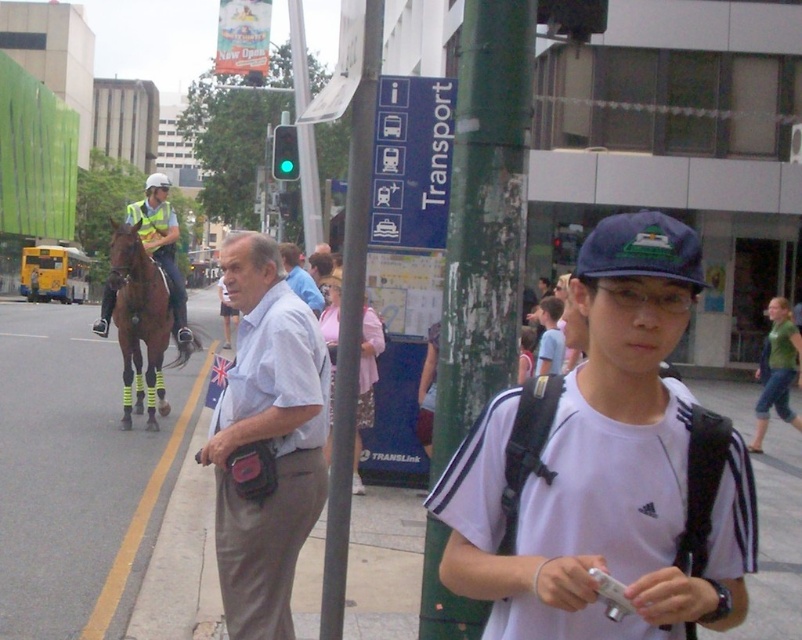
In the scene shown: You are a delivery robot with a 2 meter wide package. You need to navigate from the yellow asphalt at left to the light blue shirt at center. Can you safely pass through the 10.47 meters distance without any obstacles?

The distance between the yellow asphalt at left and the light blue shirt at center is 10.47 meters. Since the path is clear and the package is 2 meters wide, the robot can safely navigate the distance as there are no mentioned obstacles in the scene description.

You are a delivery person who needs to place a package on the green painted metal pole at center. However, there is a shiny brown horse at left nearby. Can you place the package on the pole without the horse interfering?

The green painted metal pole at center is below the shiny brown horse at left, so placing the package on the pole might be possible as the horse is positioned higher up and less likely to interfere.

You are a delivery robot that needs to navigate between the yellow asphalt at left and the green rough textured pole at center. Which path is wider for your movement?

The yellow asphalt at left might be wider than the green rough textured pole at center, so the robot should choose the yellow asphalt at left for easier navigation.